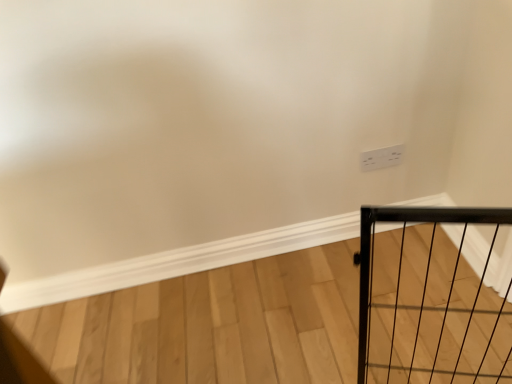
The height and width of the screenshot is (384, 512). Identify the location of white plastic electric outlet at upper center. (381, 158).

The image size is (512, 384). What do you see at coordinates (381, 158) in the screenshot?
I see `white plastic electric outlet at upper center` at bounding box center [381, 158].

This screenshot has width=512, height=384. In order to click on white plastic electric outlet at upper center in this screenshot , I will do `click(381, 158)`.